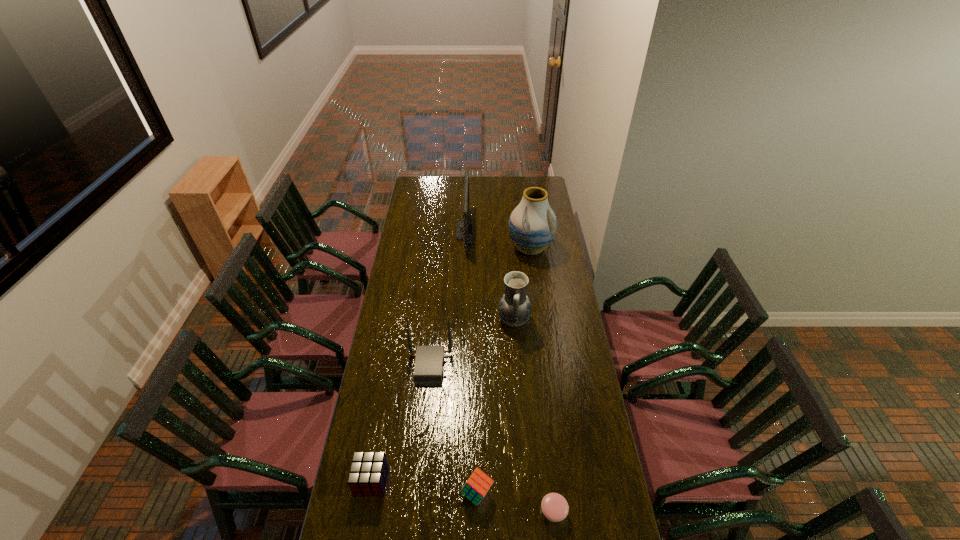
Identify the location of vacant space located 0.300m on the front-facing side of the pitcher. This screenshot has width=960, height=540. (434, 320).

Find the location of a particular element. free space located on the front-facing side of the pitcher is located at coordinates (464, 320).

Where is `free space located on the front-facing side of the pitcher`? free space located on the front-facing side of the pitcher is located at coordinates (468, 320).

This screenshot has height=540, width=960. What are the coordinates of `free space located on the back of the router to connect cables` in the screenshot? It's located at (501, 367).

Identify the location of vacant space located on the back of the leftmost object. (380, 431).

Image resolution: width=960 pixels, height=540 pixels. I want to click on vacant region located on the back of the right cube, so click(477, 458).

This screenshot has height=540, width=960. In order to click on vacant space situated 0.280m on the left of the shortest object in this screenshot , I will do `click(455, 512)`.

Identify the location of router that is at the left edge. The image size is (960, 540). (428, 370).

This screenshot has height=540, width=960. Find the location of `cube present at the left edge`. cube present at the left edge is located at coordinates click(368, 473).

At what (x,y) coordinates should I click in order to perform the action: click on object present at the right edge. Please return your answer as a coordinate pair (x, y). Looking at the image, I should click on (532, 225).